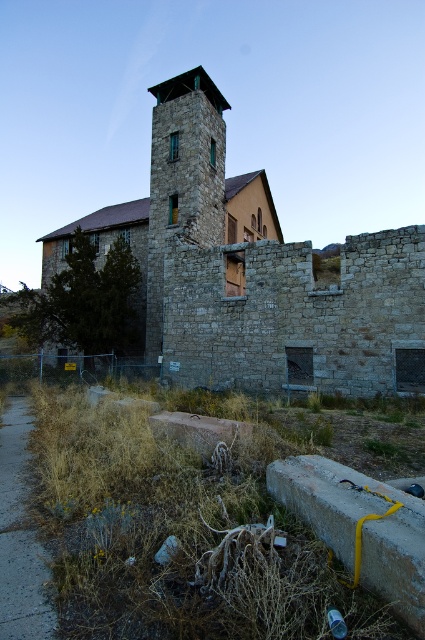
Based on the photo, you are a construction inspector evaluating the structural integrity of the stone brick fort at center and the stone tower at center. Which of these two structures has a greater width according to the provided measurements?

The stone brick fort at center has a greater width than the stone tower at center as stated in the description.

Looking at this image, you are standing in front of an old stone building. You notice two points marked on the building. One is at point coordinate (x=246, y=316) and the other is at point coordinate (x=161, y=125). Which point is closer to your current position?

Point (x=246, y=316) is closer to the camera than point (x=161, y=125), so the point at coordinate (x=246, y=316) is closer to your current position.

You are standing in front of an old stone building. You see a stone brick fort at center and a stone tower at center. Which one is closer to you?

The stone brick fort at center is closer to you because it is in front of the stone tower at center.